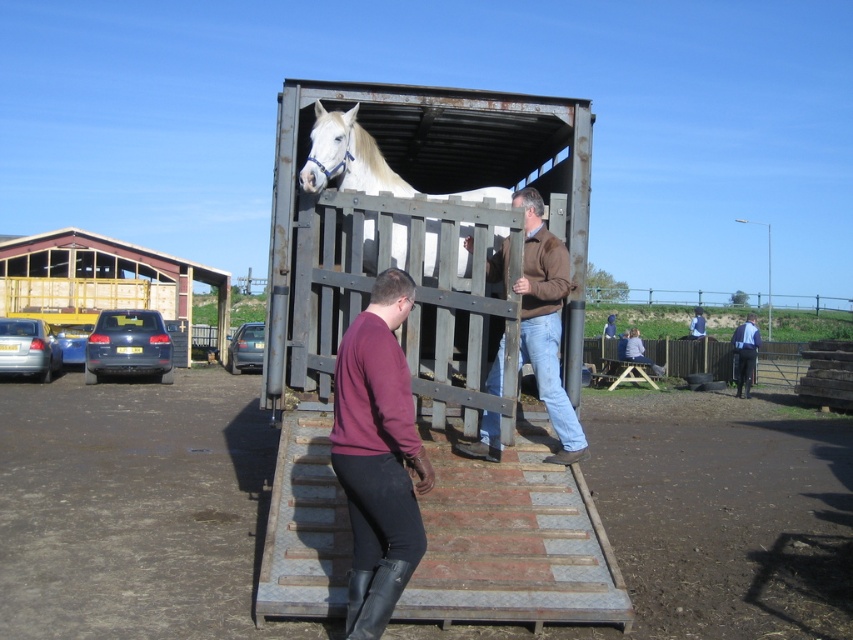
Question: Does maroon sweater at center lie in front of brown leather jacket at center?

Choices:
 (A) yes
 (B) no

Answer: (A)

Question: Estimate the real-world distances between objects in this image. Which object is closer to the brown leather jacket at center?

Choices:
 (A) white glossy horse at center
 (B) blue denim jacket at right

Answer: (A)

Question: Which of the following is the farthest from the observer?

Choices:
 (A) (379, 600)
 (B) (430, 236)
 (C) (490, 444)

Answer: (B)

Question: Where is brown leather jacket at center located in relation to blue denim jacket at right in the image?

Choices:
 (A) left
 (B) right

Answer: (A)

Question: Where is maroon sweater at center located in relation to blue denim jacket at right in the image?

Choices:
 (A) below
 (B) above

Answer: (B)

Question: Which point is farther to the camera?

Choices:
 (A) (546, 346)
 (B) (390, 248)
 (C) (746, 381)

Answer: (C)